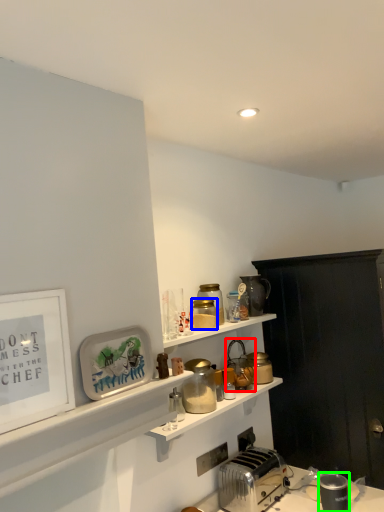
Question: Based on their relative distances, which object is farther from appliance (highlighted by a red box)? Choose from appliance (highlighted by a blue box) and appliance (highlighted by a green box).

Choices:
 (A) appliance
 (B) appliance

Answer: (B)